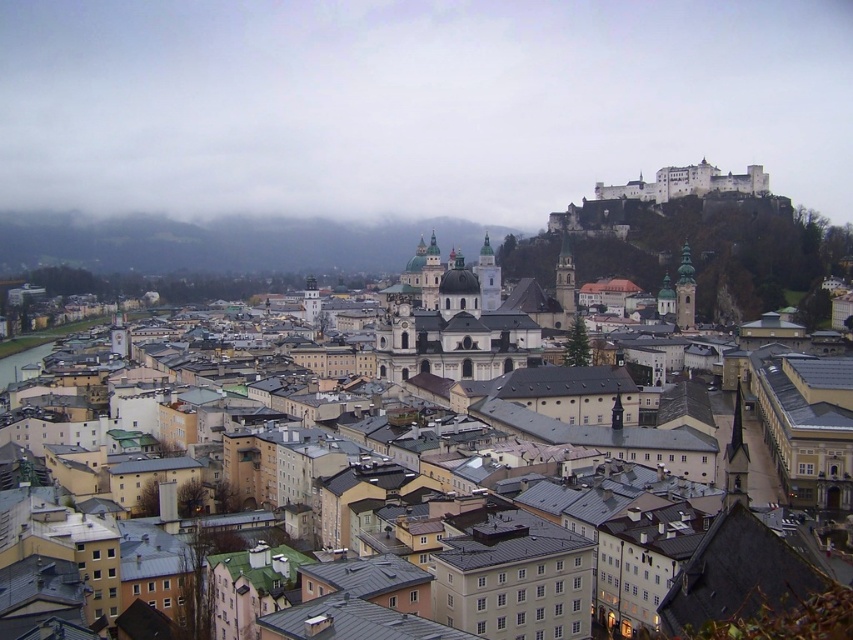
Is white stone church at center positioned before white stone castle at upper right?

Yes, white stone church at center is in front of white stone castle at upper right.

Who is taller, white stone church at center or white stone castle at upper right?

Standing taller between the two is white stone church at center.

This screenshot has height=640, width=853. Identify the location of white stone church at center. (448, 324).

The width and height of the screenshot is (853, 640). Find the location of `white stone church at center`. white stone church at center is located at coordinates (448, 324).

Locate an element on the screen. brown textured buildings at center is located at coordinates (67, 448).

This screenshot has height=640, width=853. What do you see at coordinates (67, 448) in the screenshot?
I see `brown textured buildings at center` at bounding box center [67, 448].

Locate an element on the screen. This screenshot has width=853, height=640. brown textured buildings at center is located at coordinates (67, 448).

Is brown textured buildings at center bigger than white stone church at center?

Indeed, brown textured buildings at center has a larger size compared to white stone church at center.

Based on the photo, who is taller, brown textured buildings at center or white stone church at center?

brown textured buildings at center is taller.

Identify the location of brown textured buildings at center. The height and width of the screenshot is (640, 853). (67, 448).

Identify the location of brown textured buildings at center. The width and height of the screenshot is (853, 640). (67, 448).